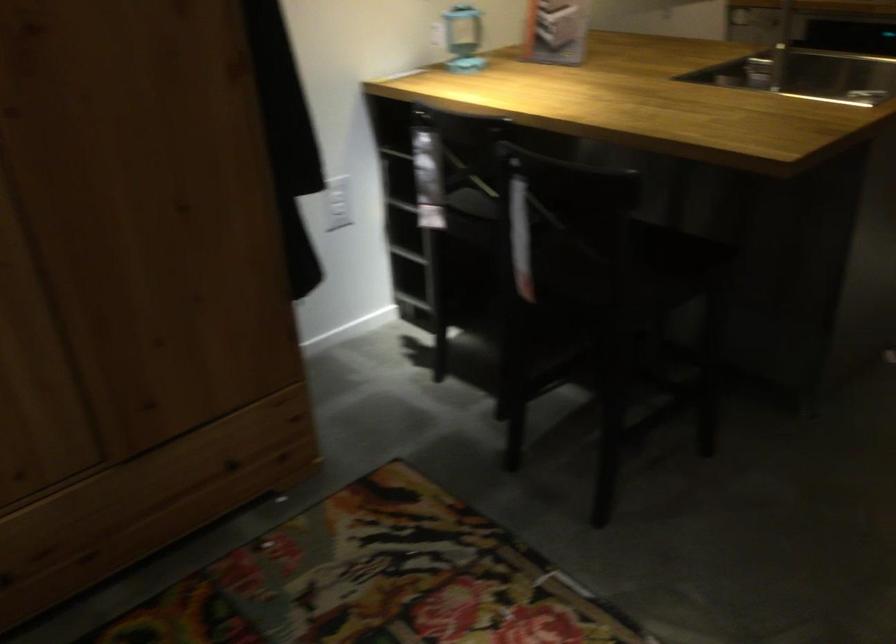
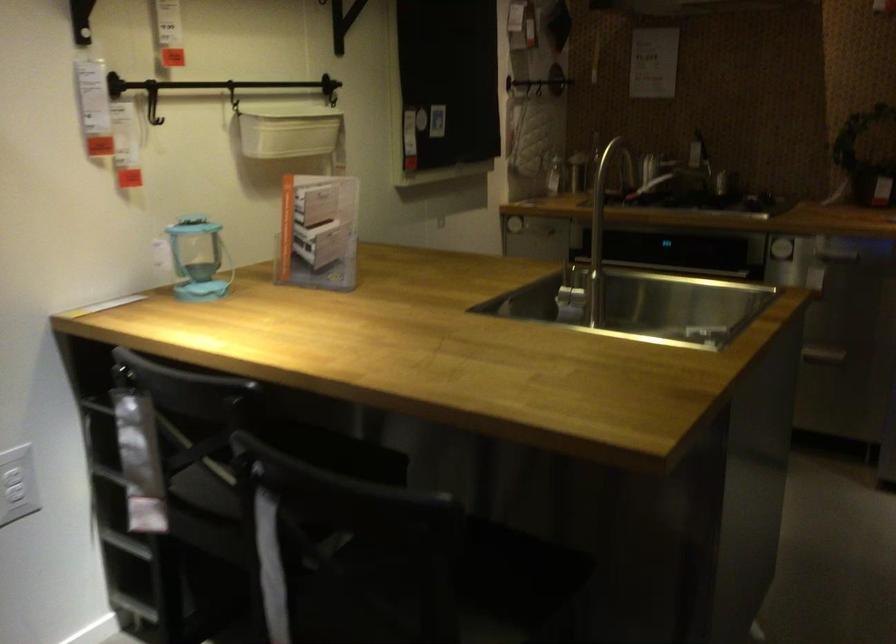
Question: The first image is from the beginning of the video and the second image is from the end. How did the camera likely rotate when shooting the video?

Choices:
 (A) Left
 (B) Right
 (C) Up
 (D) Down

Answer: (B)